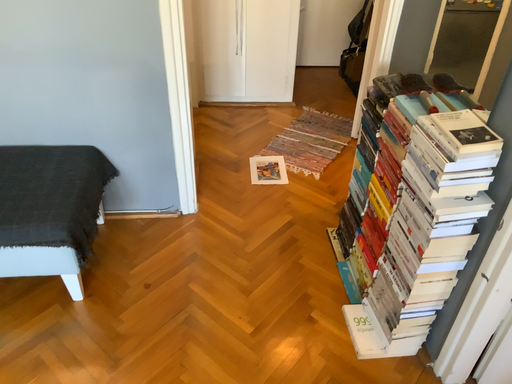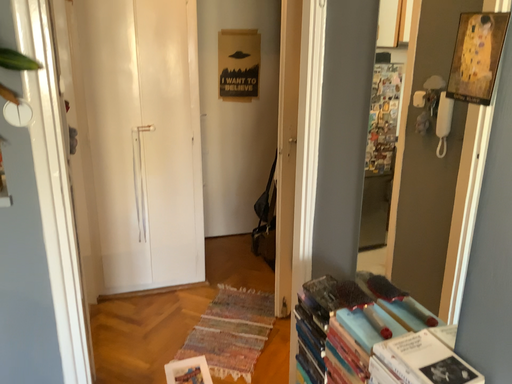
Question: Which way did the camera rotate in the video?

Choices:
 (A) rotated upward
 (B) rotated downward

Answer: (A)